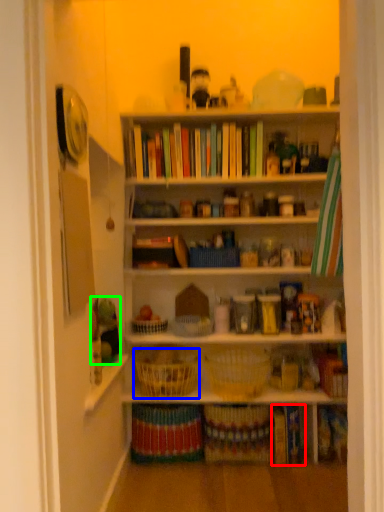
Question: Which object is positioned closest to book (highlighted by a red box)? Select from basket (highlighted by a blue box) and toy (highlighted by a green box).

Choices:
 (A) basket
 (B) toy

Answer: (A)